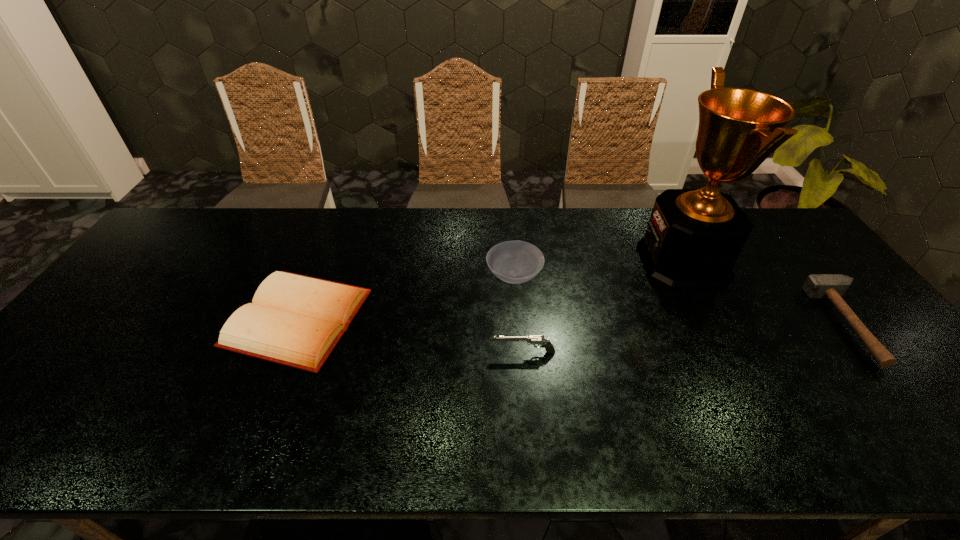
Find the location of a particular element. This screenshot has height=540, width=960. vacant space situated 0.350m on the front-facing side of the pistol is located at coordinates (354, 352).

Image resolution: width=960 pixels, height=540 pixels. I want to click on free space located 0.180m on the front-facing side of the pistol, so click(421, 352).

You are a GUI agent. You are given a task and a screenshot of the screen. Output one action in this format:
    pyautogui.click(x=<x>, y=<y>)
    Task: Click on the free space located on the front-facing side of the pistol
    
    Given the screenshot: What is the action you would take?
    pyautogui.click(x=414, y=352)

Image resolution: width=960 pixels, height=540 pixels. Identify the location of vacant region located 0.190m on the striking surface of the hammer. (756, 325).

Locate an element on the screen. The image size is (960, 540). free region located on the striking surface of the hammer is located at coordinates (x=689, y=325).

Where is `free space located on the striking surface of the hammer`? free space located on the striking surface of the hammer is located at coordinates (794, 325).

The width and height of the screenshot is (960, 540). I want to click on free space located on the back of the leftmost object, so tap(332, 235).

The width and height of the screenshot is (960, 540). In order to click on object situated at the far edge in this screenshot , I will do `click(694, 236)`.

Where is `object that is positioned at the right edge`? This screenshot has height=540, width=960. object that is positioned at the right edge is located at coordinates 832,286.

At what (x,y) coordinates should I click in order to perform the action: click on blank area at the far edge. Please return your answer as a coordinate pair (x, y). The height and width of the screenshot is (540, 960). Looking at the image, I should click on (591, 247).